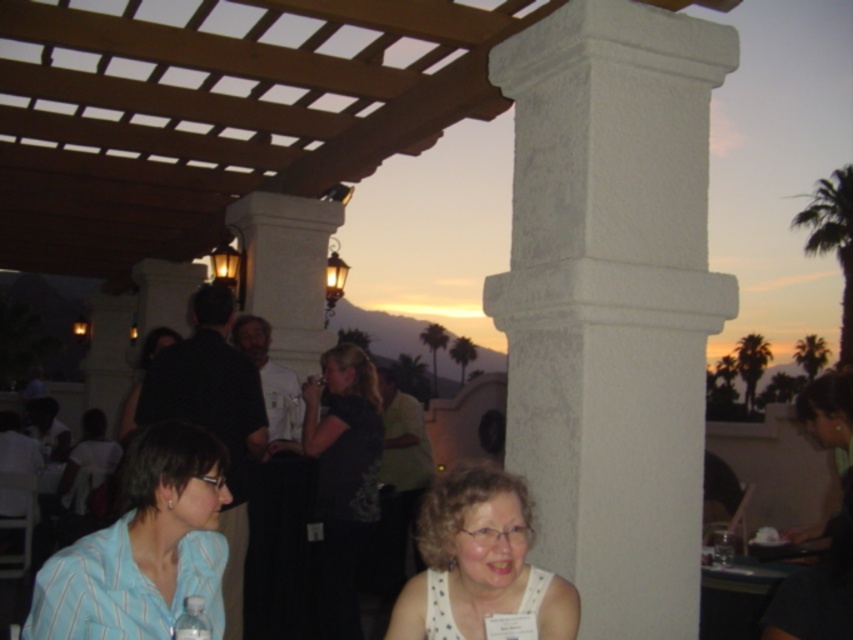
Question: Is blue striped shirt at lower left wider than black matte shirt at center?

Choices:
 (A) yes
 (B) no

Answer: (B)

Question: Estimate the real-world distances between objects in this image. Which object is farther from the white stone column at center?

Choices:
 (A) black matte shirt at center
 (B) white dotted tank top at lower center
 (C) dark fabric dress at center
 (D) blue striped shirt at lower left

Answer: (C)

Question: Can you confirm if white dotted tank top at lower center is positioned to the right of dark fabric dress at center?

Choices:
 (A) no
 (B) yes

Answer: (B)

Question: Considering the real-world distances, which object is closest to the white dotted tank top at lower center?

Choices:
 (A) blue striped shirt at lower left
 (B) dark fabric dress at center
 (C) black matte shirt at center
 (D) white stone column at center

Answer: (A)

Question: Can you confirm if white stone column at center is positioned below black matte shirt at center?

Choices:
 (A) no
 (B) yes

Answer: (A)

Question: Which of these objects is positioned closest to the dark fabric dress at center?

Choices:
 (A) white stone column at center
 (B) blue striped shirt at lower left
 (C) white dotted tank top at lower center
 (D) black matte shirt at center

Answer: (D)